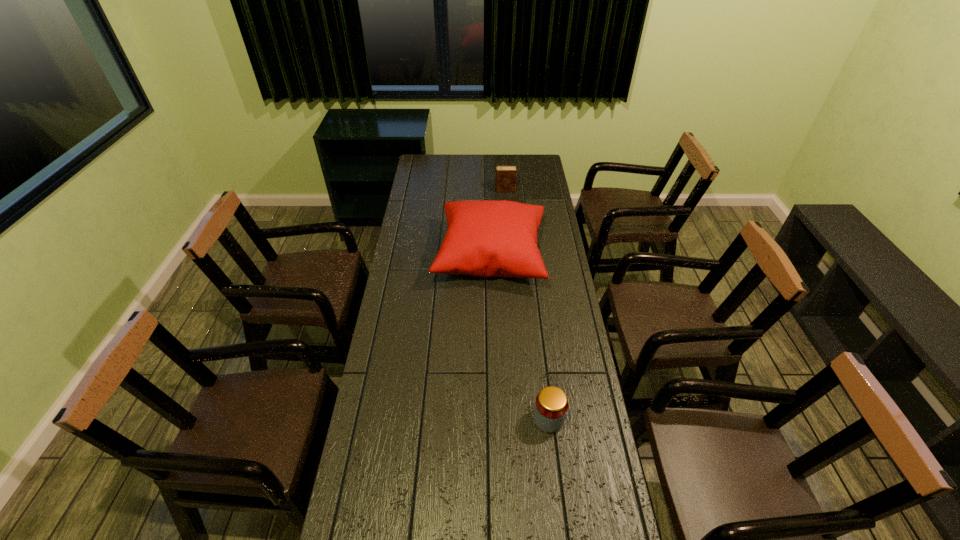
At what (x,y) coordinates should I click in order to perform the action: click on the second farthest object. Please return your answer as a coordinate pair (x, y). This screenshot has width=960, height=540. Looking at the image, I should click on (485, 238).

Where is `the tallest object`? the tallest object is located at coordinates (485, 238).

At what (x,y) coordinates should I click in order to perform the action: click on diary. Please return your answer as a coordinate pair (x, y). The image size is (960, 540). Looking at the image, I should click on (505, 180).

At what (x,y) coordinates should I click in order to perform the action: click on jar. Please return your answer as a coordinate pair (x, y). Looking at the image, I should click on coord(551,404).

The width and height of the screenshot is (960, 540). What are the coordinates of `free space located on the left of the second farthest object` in the screenshot? It's located at (423, 256).

The width and height of the screenshot is (960, 540). Identify the location of vacant area situated on the spine side of the farthest object. (426, 190).

You are a GUI agent. You are given a task and a screenshot of the screen. Output one action in this format:
    pyautogui.click(x=<x>, y=<y>)
    Task: Click on the vacant space positioned 0.230m on the spine side of the farthest object
    This screenshot has height=540, width=960.
    Given the screenshot: What is the action you would take?
    pyautogui.click(x=451, y=190)

Locate an element on the screen. vacant position located 0.140m on the spine side of the farthest object is located at coordinates (468, 190).

This screenshot has width=960, height=540. In order to click on free region located 0.240m on the back of the jar in this screenshot , I will do `click(540, 345)`.

Locate an element on the screen. cushion that is at the right edge is located at coordinates (485, 238).